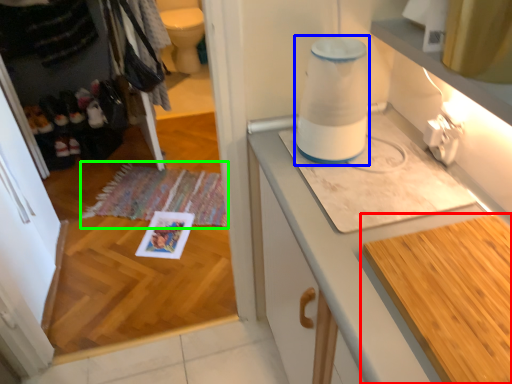
Question: Based on their relative distances, which object is nearer to countertop (highlighted by a red box)? Choose from blender (highlighted by a blue box) and mat (highlighted by a green box).

Choices:
 (A) blender
 (B) mat

Answer: (A)